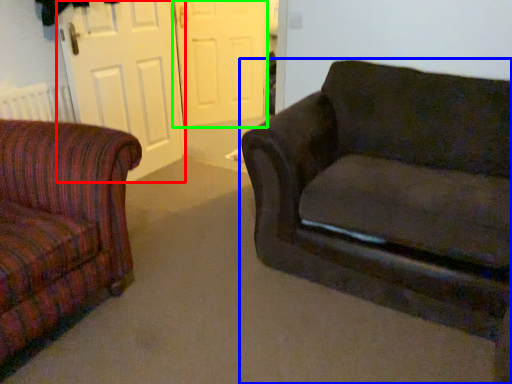
Question: Which object is positioned farthest from screen door (highlighted by a red box)? Select from studio couch (highlighted by a blue box) and screen door (highlighted by a green box).

Choices:
 (A) studio couch
 (B) screen door

Answer: (A)